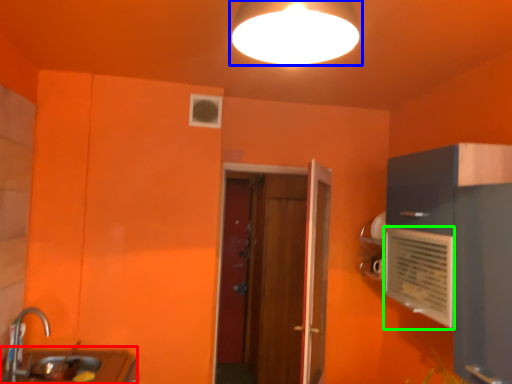
Question: Which is nearer to the counter top (highlighted by a red box)? lamp (highlighted by a blue box) or air conditioning (highlighted by a green box).

Choices:
 (A) lamp
 (B) air conditioning

Answer: (B)